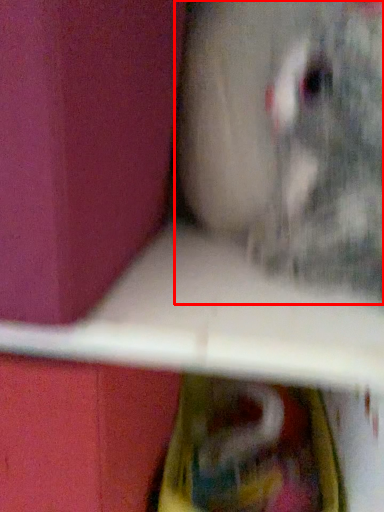
Question: Observing the image, what is the correct spatial positioning of animal (annotated by the red box) in reference to box?

Choices:
 (A) left
 (B) right

Answer: (B)